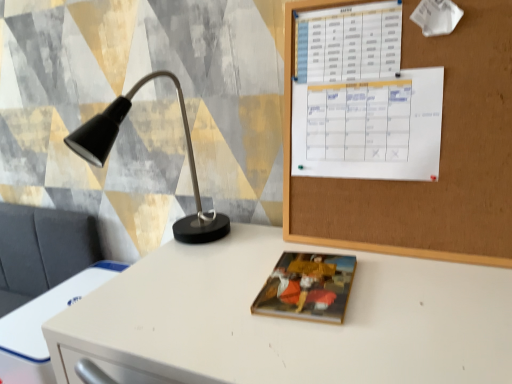
The width and height of the screenshot is (512, 384). What do you see at coordinates (440, 154) in the screenshot? I see `corkboard at upper right` at bounding box center [440, 154].

The width and height of the screenshot is (512, 384). Describe the element at coordinates (308, 287) in the screenshot. I see `matte paper book at center` at that location.

In order to face white glossy desk at center, should I rotate leftwards or rightwards?

A 0.109 degree turn to the right will do.

Image resolution: width=512 pixels, height=384 pixels. What are the coordinates of `matte black lamp at left` in the screenshot? It's located at (113, 143).

Which object is more forward, white plastic drawer at lower left or matte black lamp at left?

Positioned in front is matte black lamp at left.

Considering the relative positions of white plastic drawer at lower left and matte black lamp at left in the image provided, is white plastic drawer at lower left to the right of matte black lamp at left from the viewer's perspective?

Incorrect, white plastic drawer at lower left is not on the right side of matte black lamp at left.

Is white plastic drawer at lower left not close to matte black lamp at left?

They are positioned close to each other.

Is white plastic drawer at lower left not inside matte black lamp at left?

Yes, white plastic drawer at lower left is located beyond the bounds of matte black lamp at left.

Can we say matte black lamp at left lies outside corkboard at upper right?

Indeed, matte black lamp at left is completely outside corkboard at upper right.

Is point (198, 188) closer or farther from the camera than point (390, 237)?

Point (198, 188).

Would you consider matte black lamp at left to be distant from corkboard at upper right?

No, there isn't a large distance between matte black lamp at left and corkboard at upper right.

Is matte black lamp at left shorter than corkboard at upper right?

Yes.

Considering the positions of objects white glossy desk at center and corkboard at upper right in the image provided, who is more to the left, white glossy desk at center or corkboard at upper right?

white glossy desk at center.

Is white glossy desk at center far away from corkboard at upper right?

Actually, white glossy desk at center and corkboard at upper right are a little close together.

Image resolution: width=512 pixels, height=384 pixels. I want to click on desk on the left of the corkboard at upper right, so click(286, 321).

Does matte paper book at center have a smaller size compared to white paper calendar at upper right?

Correct, matte paper book at center occupies less space than white paper calendar at upper right.

Is matte paper book at center closer to the viewer compared to white paper calendar at upper right?

Yes, it is in front of white paper calendar at upper right.

Would you say matte paper book at center is inside or outside white paper calendar at upper right?

matte paper book at center cannot be found inside white paper calendar at upper right.

From the picture: How different are the orientations of matte paper book at center and white paper calendar at upper right in degrees?

They differ by 7.48 degrees in their facing directions.

Between white paper calendar at upper right and matte paper book at center, which one has smaller size?

With smaller size is matte paper book at center.

Is white paper calendar at upper right wider than matte paper book at center?

In fact, white paper calendar at upper right might be narrower than matte paper book at center.

Considering the positions of points (331, 95) and (277, 307), is point (331, 95) farther from camera compared to point (277, 307)?

That is True.

I want to click on calendar that is on the right side of matte paper book at center, so click(x=369, y=128).

Is matte paper book at center surrounding white plastic drawer at lower left?

No, white plastic drawer at lower left is located outside of matte paper book at center.

Does point (350, 262) lie in front of point (33, 299)?

Yes, point (350, 262) is in front of point (33, 299).

Considering the positions of objects matte paper book at center and white plastic drawer at lower left in the image provided, who is more to the left, matte paper book at center or white plastic drawer at lower left?

From the viewer's perspective, white plastic drawer at lower left appears more on the left side.

From the image's perspective, between white glossy desk at center and matte paper book at center, which one is located above?

matte paper book at center is shown above in the image.

Looking at their sizes, would you say white glossy desk at center is wider or thinner than matte paper book at center?

In the image, white glossy desk at center appears to be wider than matte paper book at center.

Is point (465, 353) positioned after point (281, 267)?

No, it is in front of (281, 267).

From a real-world perspective, is white glossy desk at center above or below matte paper book at center?

Clearly, from a real-world perspective, white glossy desk at center is below matte paper book at center.

In the image, there is a matte black lamp at left. Where is `computer desk below it (from a real-world perspective)`? This screenshot has width=512, height=384. computer desk below it (from a real-world perspective) is located at coordinates (41, 325).

This screenshot has width=512, height=384. I want to click on lamp lying on the left of corkboard at upper right, so click(113, 143).

From the image, which object appears to be nearer to corkboard at upper right, matte paper book at center or white paper calendar at upper right?

white paper calendar at upper right lies closer to corkboard at upper right than the other object.

Considering their positions, is white paper calendar at upper right positioned further to white plastic drawer at lower left than matte black lamp at left?

white paper calendar at upper right lies further to white plastic drawer at lower left than the other object.

From the image, which object appears to be farther from matte black lamp at left, corkboard at upper right or matte paper book at center?

Based on the image, corkboard at upper right appears to be further to matte black lamp at left.

In the scene shown: Looking at the image, which one is located further to white paper calendar at upper right, white plastic drawer at lower left or white glossy desk at center?

white plastic drawer at lower left lies further to white paper calendar at upper right than the other object.

Which object lies further to the anchor point corkboard at upper right, white glossy desk at center or matte black lamp at left?

matte black lamp at left is positioned further to the anchor corkboard at upper right.

Which object lies nearer to the anchor point white plastic drawer at lower left, white glossy desk at center or matte paper book at center?

The object closer to white plastic drawer at lower left is white glossy desk at center.

Looking at this image, which object lies further to the anchor point matte paper book at center, matte black lamp at left or white paper calendar at upper right?

matte black lamp at left is further to matte paper book at center.

Looking at the image, which one is located further to white paper calendar at upper right, corkboard at upper right or matte black lamp at left?

The object further to white paper calendar at upper right is matte black lamp at left.

Where is `book cover between white plastic drawer at lower left and white paper calendar at upper right from left to right`? This screenshot has height=384, width=512. book cover between white plastic drawer at lower left and white paper calendar at upper right from left to right is located at coordinates (308, 287).

You are a GUI agent. You are given a task and a screenshot of the screen. Output one action in this format:
    pyautogui.click(x=<x>, y=<y>)
    Task: Click on the lamp between corkboard at upper right and white glossy desk at center from top to bottom
    This screenshot has height=384, width=512.
    Given the screenshot: What is the action you would take?
    pyautogui.click(x=113, y=143)

At what (x,y) coordinates should I click in order to perform the action: click on book cover that lies between white paper calendar at upper right and white glossy desk at center from top to bottom. Please return your answer as a coordinate pair (x, y). This screenshot has height=384, width=512. Looking at the image, I should click on (308, 287).

Locate an element on the screen. book cover between matte black lamp at left and white glossy desk at center in the up-down direction is located at coordinates (308, 287).